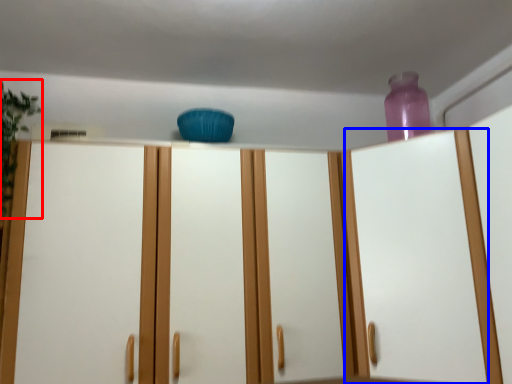
Question: Among these objects, which one is nearest to the camera, plant (highlighted by a red box) or glass door (highlighted by a blue box)?

Choices:
 (A) plant
 (B) glass door

Answer: (B)